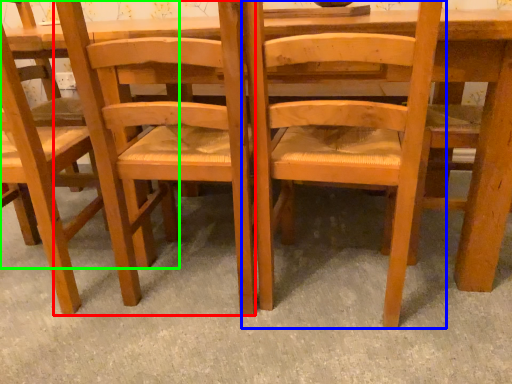
Question: Which object is the farthest from chair (highlighted by a red box)? Choose among these: chair (highlighted by a blue box) or chair (highlighted by a green box).

Choices:
 (A) chair
 (B) chair

Answer: (B)